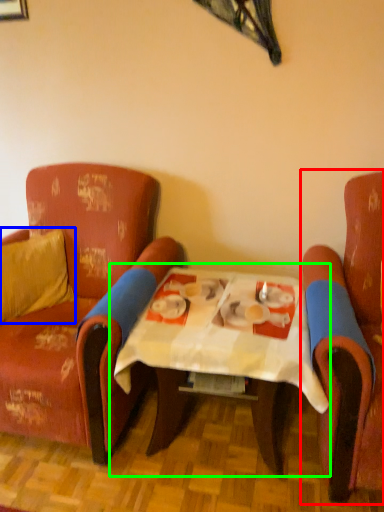
Question: Considering the real-world distances, which object is closest to chair (highlighted by a red box)? pillow (highlighted by a blue box) or table (highlighted by a green box).

Choices:
 (A) pillow
 (B) table

Answer: (B)